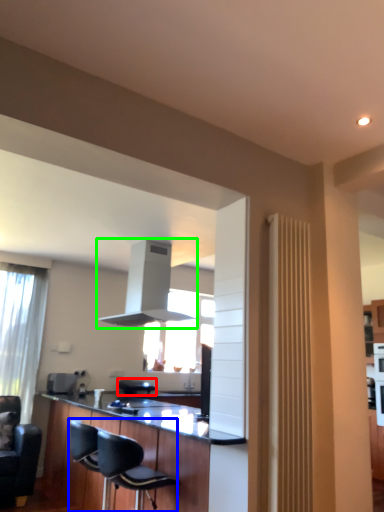
Question: Which is nearer to the armchair (highlighted by a red box)? chair (highlighted by a blue box) or exhaust hood (highlighted by a green box).

Choices:
 (A) chair
 (B) exhaust hood

Answer: (A)